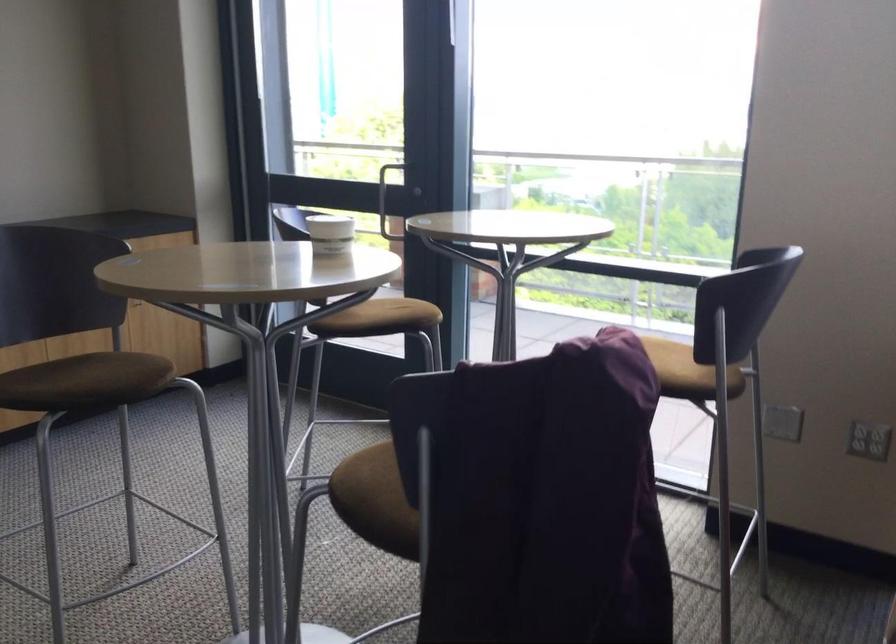
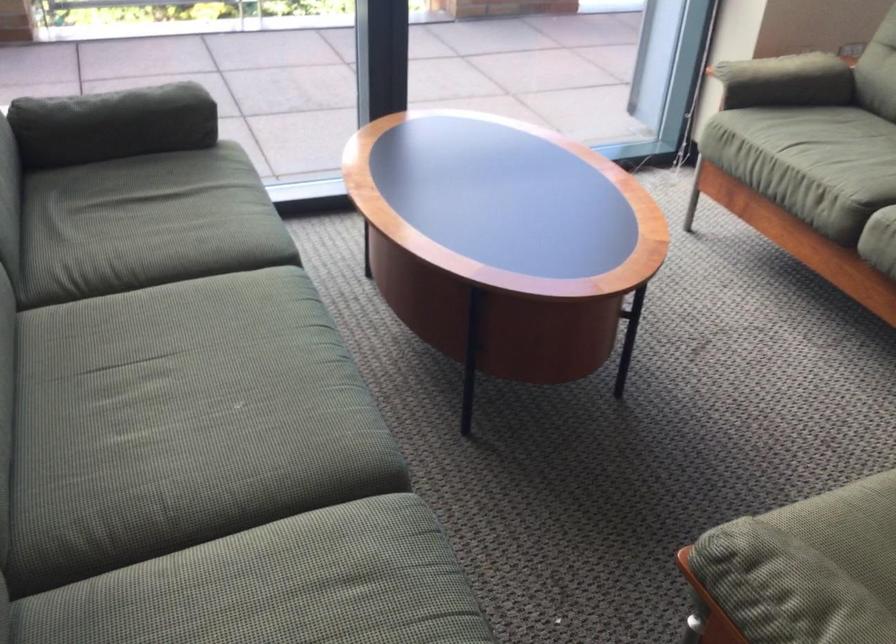
The first image is from the beginning of the video and the second image is from the end. How did the camera likely rotate when shooting the video?

The rotation direction of the camera is right-down.